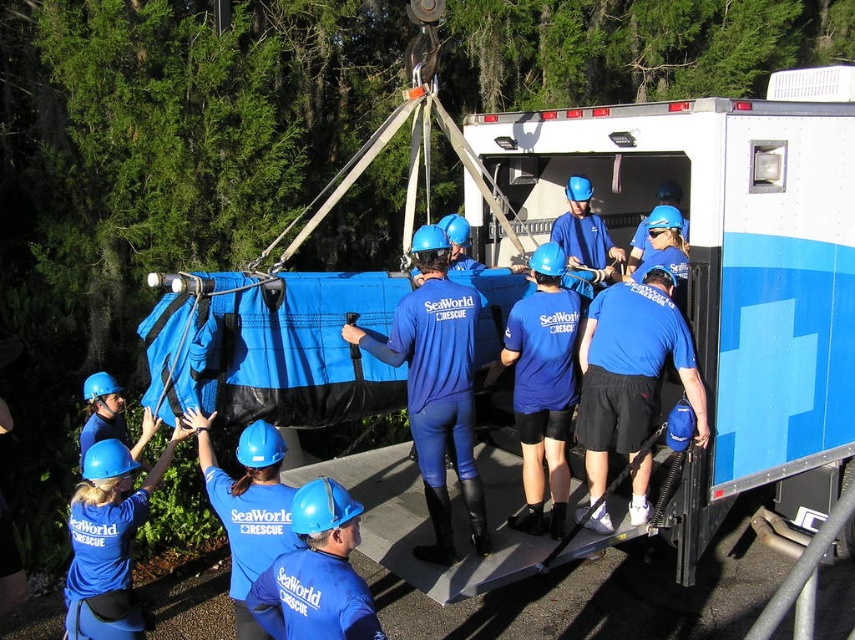
You are a photographer trying to capture a clear photo of the blue matte helmet at center and the matte blue helmet at upper left. Since you want both helmets in focus, which helmet should you adjust your camera focus on first?

The blue matte helmet at center is behind the matte blue helmet at upper left, so you should focus on the matte blue helmet at upper left first to ensure both are in focus.

You are a safety inspector observing the scene. You notice two items of safety gear used by the rescue team. The blue matte shorts at center and the matte blue helmet at upper left. Which item is positioned higher in the image?

The blue matte shorts at center is above the matte blue helmet at upper left, so the blue matte shorts at center is positioned higher in the image.

You are a photographer trying to capture a clear shot of both the blue matte shorts at center and the blue matte helmet at center. Since you want to frame them together, which object should you position to the left to include both in the photo?

The blue matte helmet at center should be positioned to the left because the blue matte shorts at center is on the right side of it, allowing both to be framed together.